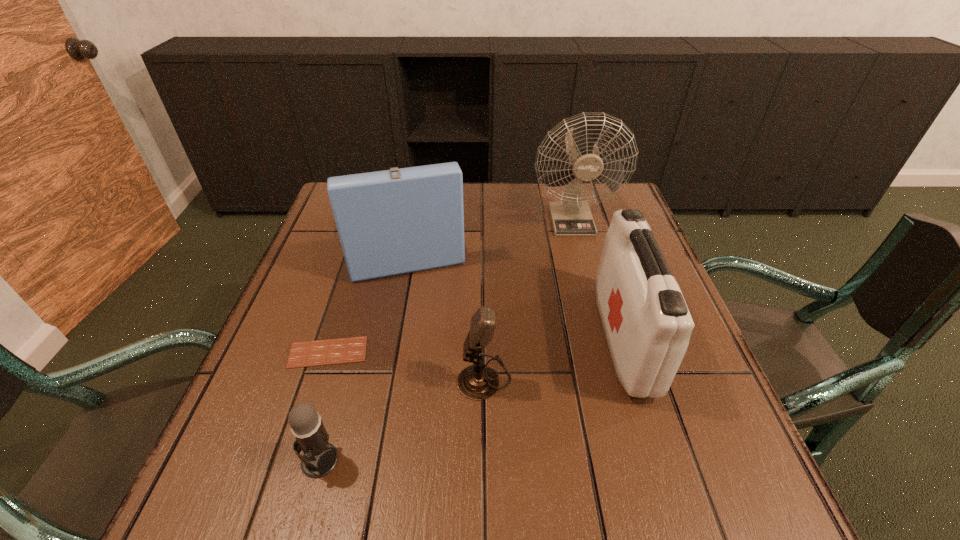
You are a GUI agent. You are given a task and a screenshot of the screen. Output one action in this format:
    pyautogui.click(x=<x>, y=<y>)
    Task: Click on the vacant space located 0.310m on the front side of the first-aid kit
    This screenshot has width=960, height=540.
    Given the screenshot: What is the action you would take?
    pyautogui.click(x=458, y=339)

In order to click on vacant point located 0.050m on the front side of the first-aid kit in this screenshot , I will do `click(582, 339)`.

The height and width of the screenshot is (540, 960). I want to click on vacant space positioned 0.290m on the front side of the first-aid kit, so click(467, 339).

This screenshot has width=960, height=540. Identify the location of vacant region located 0.140m on the front-facing side of the right microphone. (385, 377).

Identify the location of free spot located 0.060m on the front-facing side of the right microphone. This screenshot has height=540, width=960. (426, 377).

This screenshot has width=960, height=540. I want to click on vacant space positioned 0.280m on the front-facing side of the right microphone, so click(x=313, y=377).

I want to click on vacant space located 0.300m on the back of the nearest object, so click(360, 314).

You are a GUI agent. You are given a task and a screenshot of the screen. Output one action in this format:
    pyautogui.click(x=<x>, y=<y>)
    Task: Click on the vacant region located 0.170m on the front of the chocolate bar
    
    Given the screenshot: What is the action you would take?
    pyautogui.click(x=296, y=452)

Where is `fan present at the far edge`? This screenshot has width=960, height=540. fan present at the far edge is located at coordinates (572, 217).

Find the location of `phonograph record present at the far edge`. phonograph record present at the far edge is located at coordinates (397, 221).